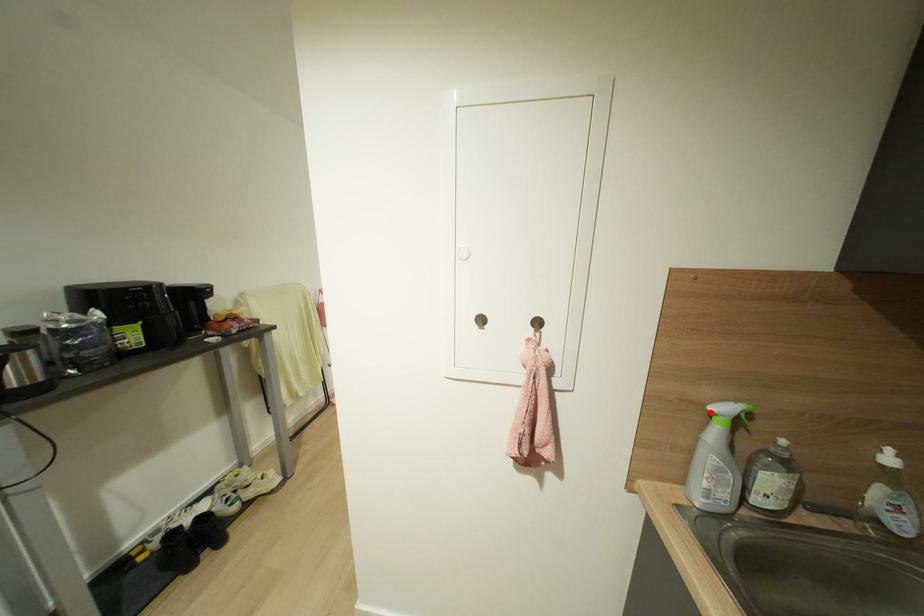
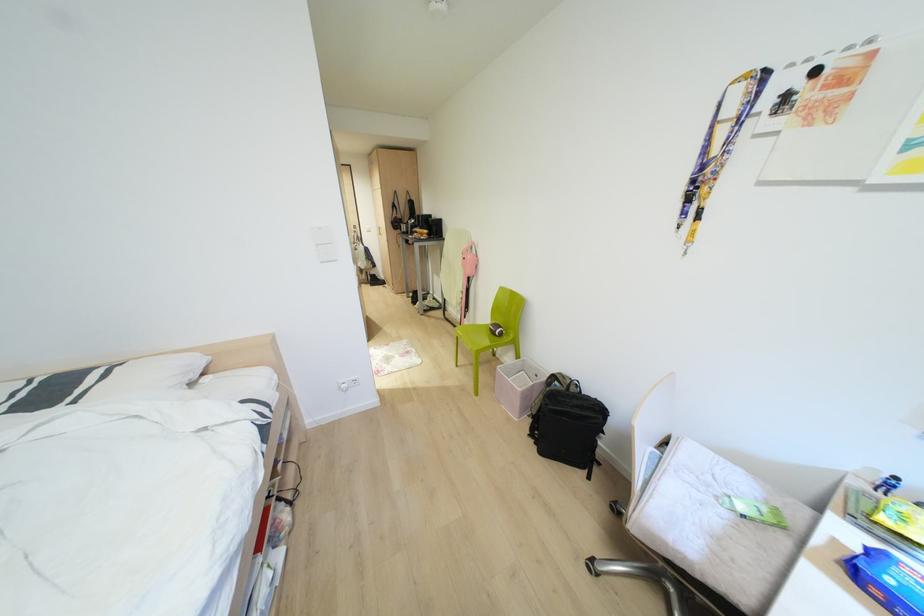
Question: I am providing you with two images of the same scene from different viewpoints. A red point is marked on the first image. Can you still see the location of the red point in image 2?

Choices:
 (A) Yes
 (B) No

Answer: (B)